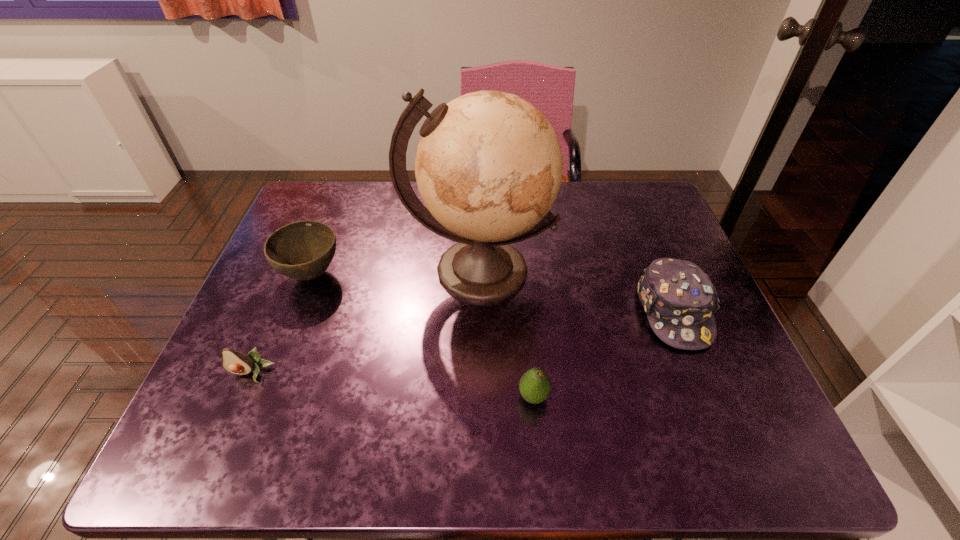
The width and height of the screenshot is (960, 540). In order to click on object identified as the second closest to the bowl in this screenshot , I will do `click(236, 362)`.

Where is `object identified as the second closest to the rightmost object`? object identified as the second closest to the rightmost object is located at coordinates (535, 385).

Image resolution: width=960 pixels, height=540 pixels. In order to click on vacant region that satisfies the following two spatial constraints: 1. on the seed side of the fourth farthest object; 2. on the left side of the nearest object in this screenshot , I will do `click(242, 396)`.

This screenshot has width=960, height=540. I want to click on vacant position in the image that satisfies the following two spatial constraints: 1. on the seed side of the left avocado; 2. on the left side of the nearest object, so click(242, 396).